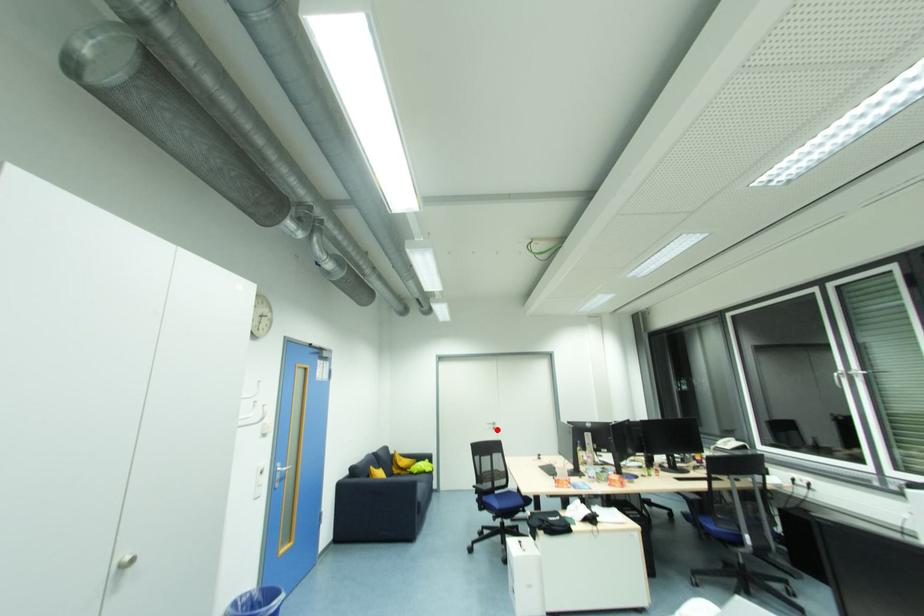
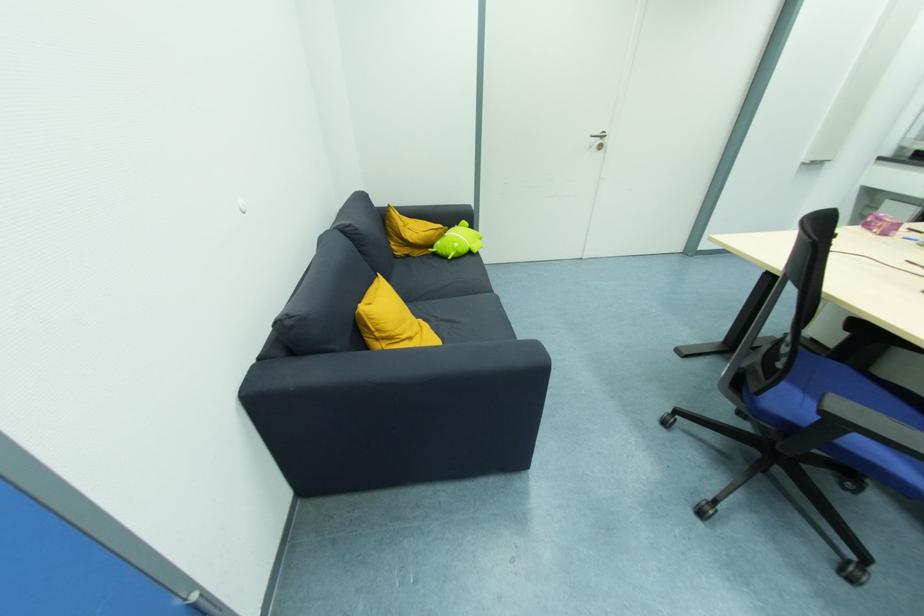
The point at the highlighted location is marked in the first image. Where is the corresponding point in the second image?

(603, 148)